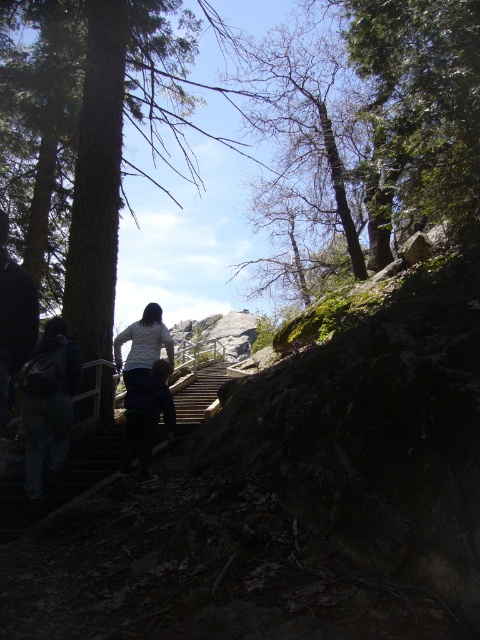
Does green textured tree at upper left have a lesser width compared to dark blue jacket at center?

No, green textured tree at upper left is not thinner than dark blue jacket at center.

The width and height of the screenshot is (480, 640). What do you see at coordinates (106, 134) in the screenshot?
I see `green textured tree at upper left` at bounding box center [106, 134].

The width and height of the screenshot is (480, 640). Identify the location of green textured tree at upper left. pos(106,134).

Is denim jacket at lower left taller than white matte shirt at center?

Yes.

Which of these two, denim jacket at lower left or white matte shirt at center, stands taller?

With more height is denim jacket at lower left.

Is point (61, 419) closer to camera compared to point (143, 365)?

Yes, point (61, 419) is in front of point (143, 365).

The width and height of the screenshot is (480, 640). I want to click on denim jacket at lower left, so click(x=48, y=403).

Who is positioned more to the right, dark blue jeans at left or white matte shirt at center?

white matte shirt at center is more to the right.

Image resolution: width=480 pixels, height=640 pixels. What are the coordinates of `dark blue jeans at left` in the screenshot? It's located at (13, 316).

The height and width of the screenshot is (640, 480). Find the location of `dark blue jeans at left`. dark blue jeans at left is located at coordinates (13, 316).